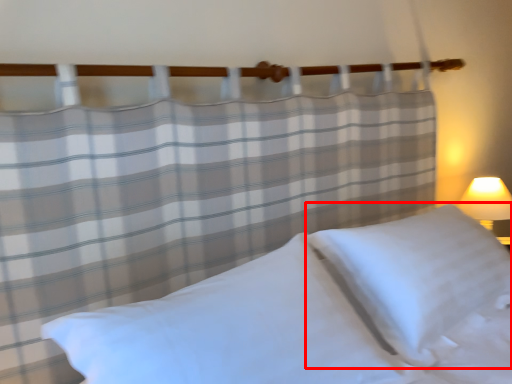
Question: From the image's perspective, where is pillow (annotated by the red box) located relative to pillow?

Choices:
 (A) below
 (B) above

Answer: (B)